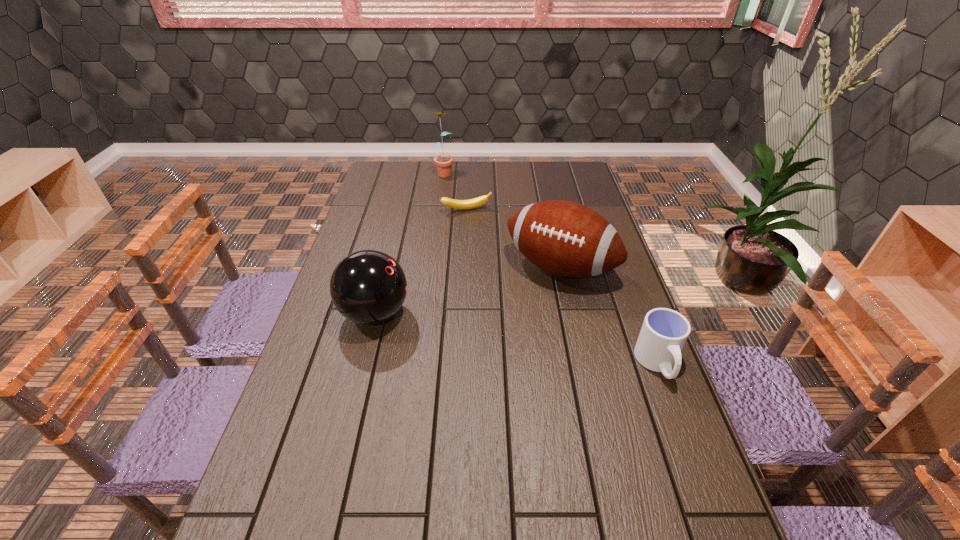
The image size is (960, 540). Find the location of `free region located at the stem of the second farthest object`. free region located at the stem of the second farthest object is located at coordinates (x=493, y=254).

Locate an element on the screen. This screenshot has height=540, width=960. vacant space located 0.190m at the stem of the second farthest object is located at coordinates (489, 244).

Where is `vacant space located on the laces of the football`? vacant space located on the laces of the football is located at coordinates (494, 352).

The height and width of the screenshot is (540, 960). Find the location of `free space located on the laces of the football`. free space located on the laces of the football is located at coordinates (516, 321).

You are a GUI agent. You are given a task and a screenshot of the screen. Output one action in this format:
    pyautogui.click(x=<x>, y=<y>)
    Task: Click on the free space located on the laces of the football
    
    Given the screenshot: What is the action you would take?
    pyautogui.click(x=526, y=307)

In order to click on free space located 0.400m on the flower of the sunflower in this screenshot , I will do `click(464, 232)`.

This screenshot has width=960, height=540. I want to click on free region located 0.180m on the flower of the sunflower, so click(x=452, y=200).

Where is `vacant space located on the flower of the sunflower`? vacant space located on the flower of the sunflower is located at coordinates (457, 214).

Locate an element on the screen. The height and width of the screenshot is (540, 960). object located in the far edge section of the desktop is located at coordinates click(443, 163).

Identify the location of object at the left edge. The height and width of the screenshot is (540, 960). [368, 287].